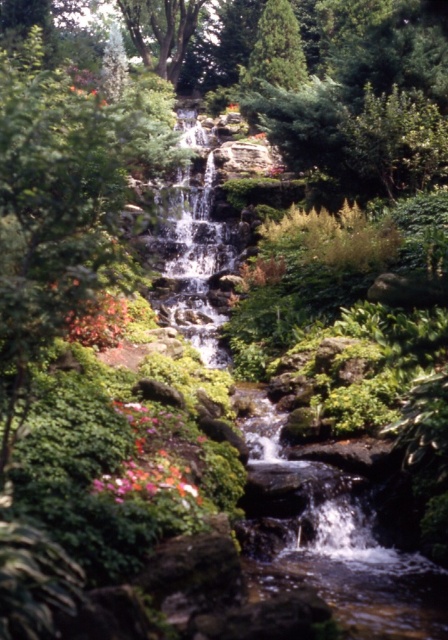
Can you confirm if clear water at center is positioned above vibrant floral bouquet at center?

Correct, clear water at center is located above vibrant floral bouquet at center.

Is clear water at center positioned before vibrant floral bouquet at center?

That is False.

Find the location of a particular element. The width and height of the screenshot is (448, 640). clear water at center is located at coordinates (193, 252).

Locate an element on the screen. Image resolution: width=448 pixels, height=640 pixels. clear water at center is located at coordinates (193, 252).

Does pink matte flowers at lower left appear under vibrant floral bouquet at center?

No, pink matte flowers at lower left is not below vibrant floral bouquet at center.

Does pink matte flowers at lower left have a greater height compared to vibrant floral bouquet at center?

Correct, pink matte flowers at lower left is much taller as vibrant floral bouquet at center.

Between point (134, 442) and point (180, 477), which one is positioned in front?

Point (180, 477) is more forward.

This screenshot has width=448, height=640. What are the coordinates of `pink matte flowers at lower left` in the screenshot? It's located at (154, 458).

Consider the image. Measure the distance between point (x=222, y=241) and camera.

Point (x=222, y=241) is 74.30 feet away from camera.

In the scene shown: Is clear water at center smaller than pink matte flowers at lower left?

Incorrect, clear water at center is not smaller in size than pink matte flowers at lower left.

This screenshot has width=448, height=640. I want to click on clear water at center, so click(x=193, y=252).

Where is `clear water at center`? Image resolution: width=448 pixels, height=640 pixels. clear water at center is located at coordinates tap(193, 252).